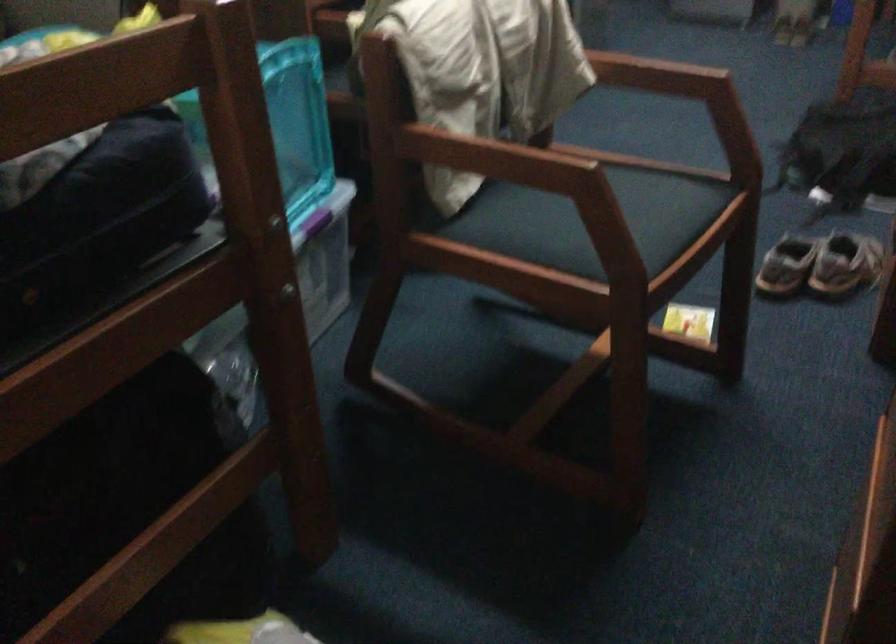
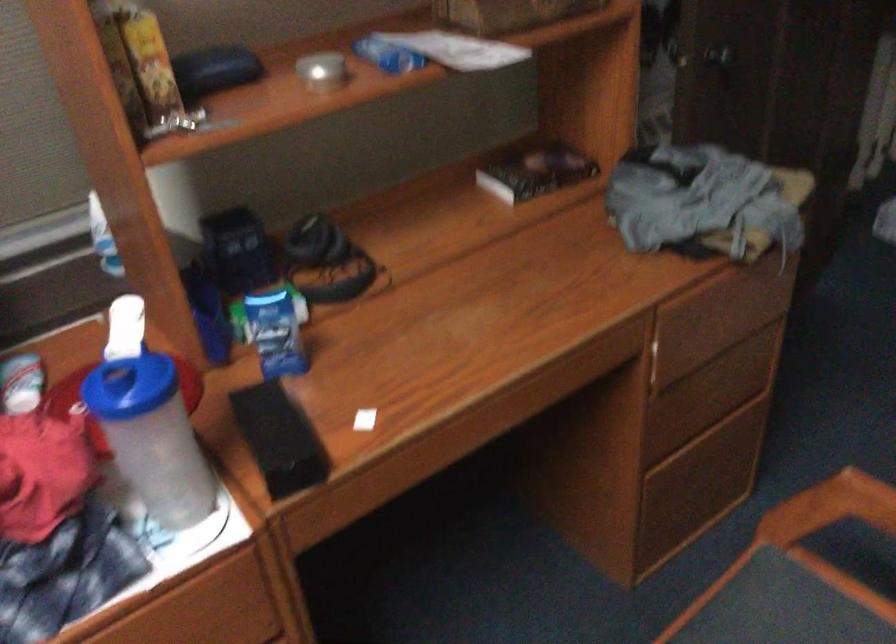
Locate, in the second image, the point that corresponds to pixel 657 269 in the first image.

(780, 614)